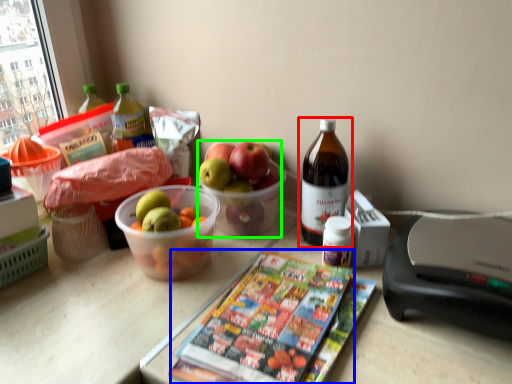
Question: Considering the real-world distances, which object is closest to bottle (highlighted by a red box)? magazine (highlighted by a blue box) or grapefruit (highlighted by a green box).

Choices:
 (A) magazine
 (B) grapefruit

Answer: (B)